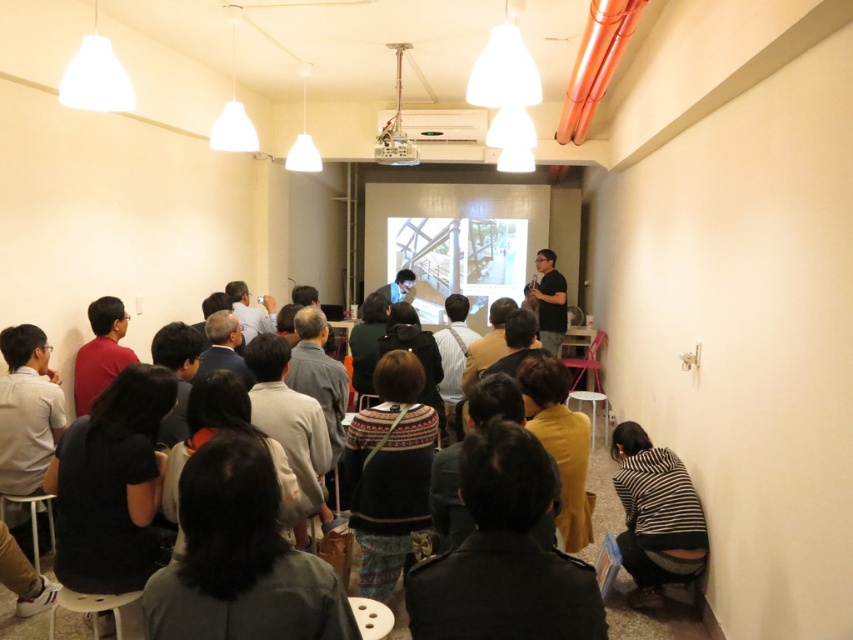
Question: Which point is closer to the camera taking this photo?

Choices:
 (A) (566, 496)
 (B) (77, 358)
 (C) (500, 356)

Answer: (A)

Question: Which of the following is the closest to the observer?

Choices:
 (A) dark green sweater at center
 (B) dark green jacket at center

Answer: (B)

Question: Is the position of dark green shirt at center more distant than that of yellow fabric at center?

Choices:
 (A) no
 (B) yes

Answer: (A)

Question: Does yellow fabric at center have a lesser width compared to black sweater at center?

Choices:
 (A) no
 (B) yes

Answer: (A)

Question: Can you confirm if dark fabric shirt at lower left is wider than knitted sweater at center?

Choices:
 (A) no
 (B) yes

Answer: (B)

Question: Which is nearer to the light brown fabric jacket at center?

Choices:
 (A) knitted sweater at center
 (B) dark fabric shirt at lower left

Answer: (A)